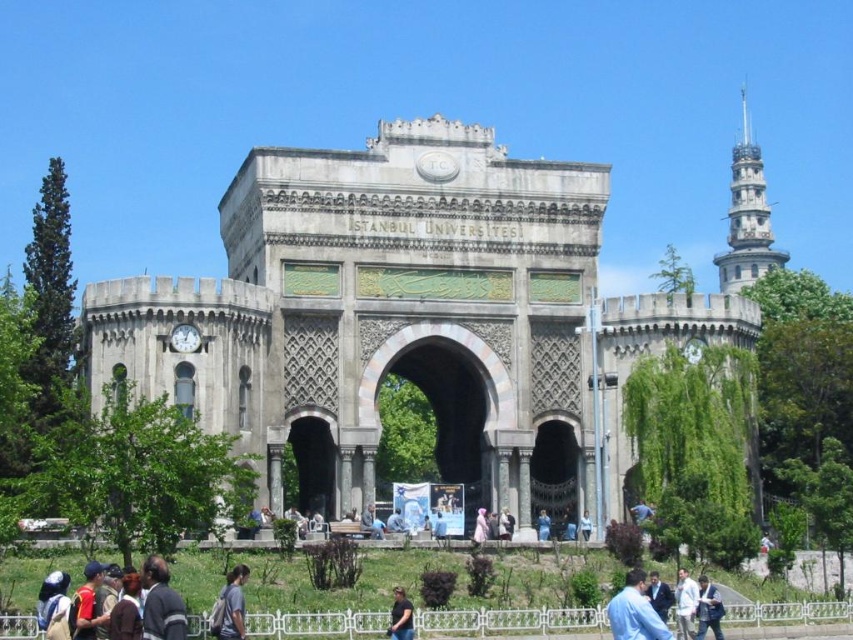
You are a photographer standing in front of the Istanbul University building. You notice two people wearing a yellow fabric shirt at lower left and a dark blue shirt at lower center. Which person is wearing a narrower shirt?

The yellow fabric shirt at lower left is narrower than the dark blue shirt at lower center because its width is less than the dark blue shirt at lower center.

You are standing in front of the Istanbul University building and notice a person wearing a blue shirt. Based on the coordinates provided, where would you look to find the blue shirt at lower right?

The blue shirt at lower right is located at the 2D coordinates point (635,611).